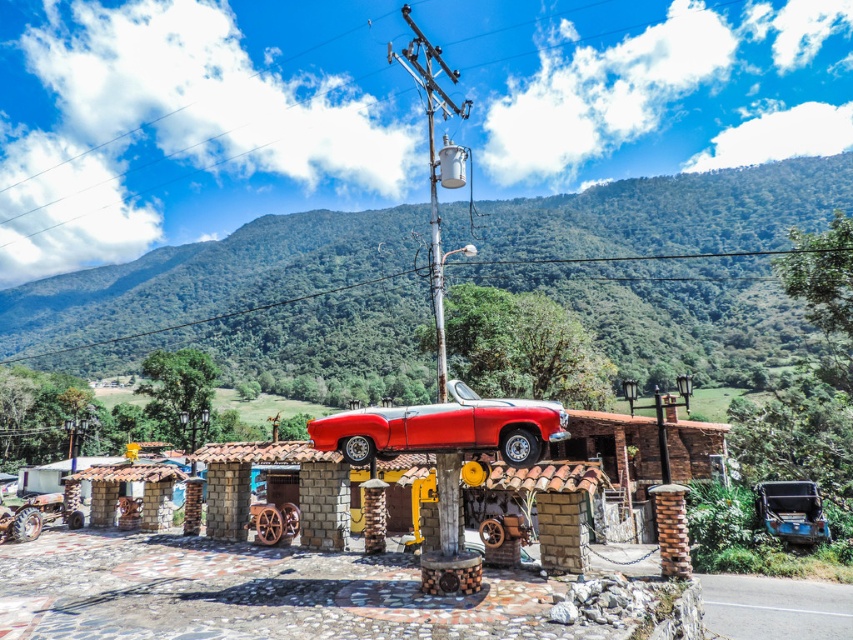
Question: Considering the real-world distances, which object is closest to the metallic gray transformer at upper center?

Choices:
 (A) brown stone pillar at center
 (B) blue metallic truck at lower right
 (C) metallic pole at upper center
 (D) shiny red car at center

Answer: (D)

Question: Which object appears farthest from the camera in this image?

Choices:
 (A) brown stone pillar at center
 (B) shiny red car at center

Answer: (A)

Question: Can you confirm if metallic pole at upper center is wider than brown stone pillar at center?

Choices:
 (A) yes
 (B) no

Answer: (A)

Question: Does shiny red car at center have a lesser width compared to metallic gray transformer at upper center?

Choices:
 (A) no
 (B) yes

Answer: (A)

Question: Is shiny red car at center positioned behind metallic pole at upper center?

Choices:
 (A) no
 (B) yes

Answer: (A)

Question: Which of these objects is positioned farthest from the brown stone pillar at center?

Choices:
 (A) blue metallic truck at lower right
 (B) metallic gray transformer at upper center
 (C) shiny red car at center
 (D) metallic pole at upper center

Answer: (D)